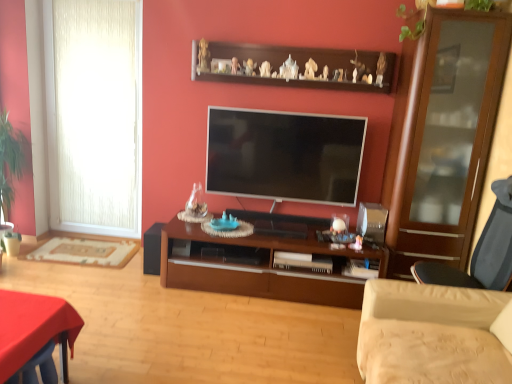
Question: Is beige fabric studio couch at lower right located within green leafy plant at upper right, the 1th plant positioned from the front?

Choices:
 (A) no
 (B) yes

Answer: (A)

Question: From the image's perspective, does green leafy plant at upper right, placed as the second plant when sorted from back to front, appear lower than beige fabric studio couch at lower right?

Choices:
 (A) yes
 (B) no

Answer: (B)

Question: From the image's perspective, is green leafy plant at upper right, which is the first plant from top to bottom, located above beige fabric studio couch at lower right?

Choices:
 (A) no
 (B) yes

Answer: (B)

Question: Is green leafy plant at upper right, which is the first plant from top to bottom, positioned in front of beige fabric studio couch at lower right?

Choices:
 (A) yes
 (B) no

Answer: (B)

Question: From a real-world perspective, is green leafy plant at upper right, the 1th plant positioned from the front, located higher than beige fabric studio couch at lower right?

Choices:
 (A) yes
 (B) no

Answer: (A)

Question: Looking at their shapes, would you say smooth red table at lower left is wider or thinner than brown wooden shelf at upper center?

Choices:
 (A) thin
 (B) wide

Answer: (B)

Question: From a real-world perspective, is smooth red table at lower left positioned above or below brown wooden shelf at upper center?

Choices:
 (A) below
 (B) above

Answer: (A)

Question: Is smooth red table at lower left spatially inside brown wooden shelf at upper center, or outside of it?

Choices:
 (A) outside
 (B) inside

Answer: (A)

Question: In the image, is smooth red table at lower left on the left side or the right side of brown wooden shelf at upper center?

Choices:
 (A) right
 (B) left

Answer: (B)

Question: Is dark gray fabric chair at right inside or outside of white textured curtain at left?

Choices:
 (A) inside
 (B) outside

Answer: (B)

Question: From the image's perspective, is dark gray fabric chair at right above or below white textured curtain at left?

Choices:
 (A) below
 (B) above

Answer: (A)

Question: Relative to white textured curtain at left, is dark gray fabric chair at right in front or behind?

Choices:
 (A) behind
 (B) front

Answer: (B)

Question: In terms of size, does dark gray fabric chair at right appear bigger or smaller than white textured curtain at left?

Choices:
 (A) small
 (B) big

Answer: (B)

Question: Is point pos(417,23) closer or farther from the camera than point pos(250,170)?

Choices:
 (A) farther
 (B) closer

Answer: (B)

Question: Looking at their shapes, would you say green leafy plant at upper right, placed as the second plant when sorted from back to front, is wider or thinner than flat screen tv at center?

Choices:
 (A) thin
 (B) wide

Answer: (B)